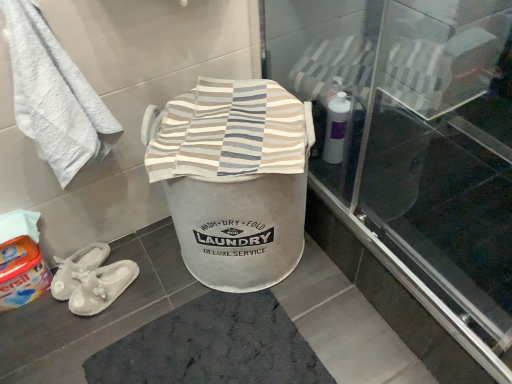
Question: Is transparent glass screen door at upper center bigger or smaller than white fabric slippers at lower left?

Choices:
 (A) big
 (B) small

Answer: (A)

Question: Considering the positions of point (394, 188) and point (111, 274), is point (394, 188) closer or farther from the camera than point (111, 274)?

Choices:
 (A) closer
 (B) farther

Answer: (B)

Question: Estimate the real-world distances between objects in this image. Which object is farther from the transparent glass screen door at upper center?

Choices:
 (A) white soft towel at upper left
 (B) white fabric slippers at lower left
 (C) striped cotton laundry basket at center
 (D) white fabric laundry basket at center
 (E) dark gray textured bath mat at center

Answer: (B)

Question: Which of these objects is positioned farthest from the dark gray textured bath mat at center?

Choices:
 (A) transparent glass screen door at upper center
 (B) striped cotton laundry basket at center
 (C) white fabric laundry basket at center
 (D) white fabric slippers at lower left
 (E) orange fabric detergent at lower left

Answer: (A)